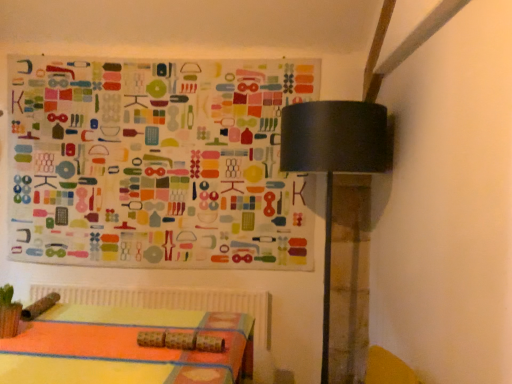
Question: From the image's perspective, is multicolored fabric at upper left positioned above or below black matte table lamp at upper right?

Choices:
 (A) below
 (B) above

Answer: (B)

Question: Based on their sizes in the image, would you say multicolored fabric at upper left is bigger or smaller than black matte table lamp at upper right?

Choices:
 (A) small
 (B) big

Answer: (A)

Question: From a real-world perspective, is multicolored fabric at upper left positioned above or below black matte table lamp at upper right?

Choices:
 (A) above
 (B) below

Answer: (A)

Question: Is black matte table lamp at upper right to the left or to the right of multicolored fabric at upper left in the image?

Choices:
 (A) right
 (B) left

Answer: (A)

Question: Is black matte table lamp at upper right in front of or behind multicolored fabric at upper left in the image?

Choices:
 (A) behind
 (B) front

Answer: (B)

Question: Looking at their shapes, would you say black matte table lamp at upper right is wider or thinner than multicolored fabric at upper left?

Choices:
 (A) thin
 (B) wide

Answer: (B)

Question: In terms of size, does black matte table lamp at upper right appear bigger or smaller than multicolored fabric at upper left?

Choices:
 (A) small
 (B) big

Answer: (B)